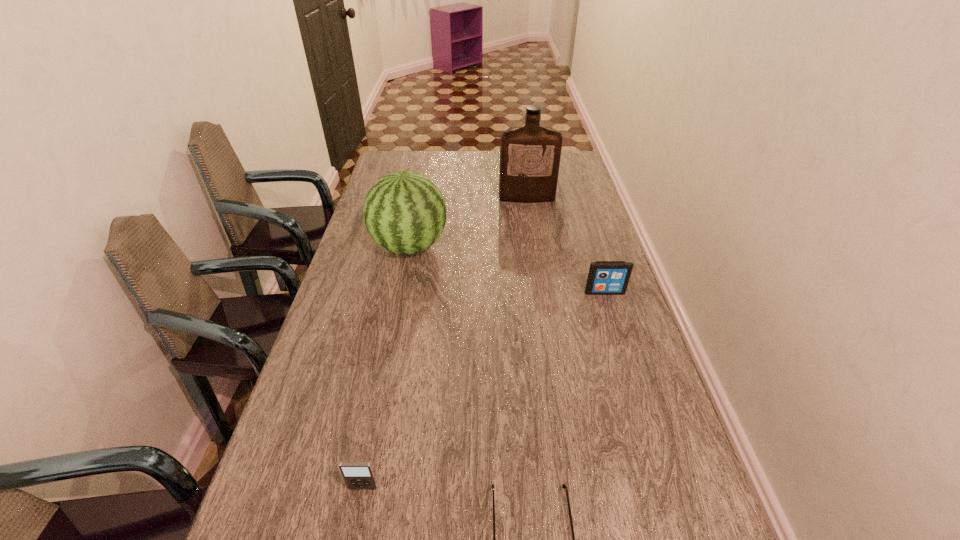
The height and width of the screenshot is (540, 960). In order to click on free space that is in between the second shortest object and the liquor in this screenshot , I will do `click(445, 343)`.

The height and width of the screenshot is (540, 960). Identify the location of vacant space that's between the third nearest object and the liquor. (565, 245).

Locate an element on the screen. This screenshot has height=540, width=960. unoccupied area between the farther iPod and the second tallest object is located at coordinates (507, 269).

Where is `free point between the shorter iPod and the watermelon`? free point between the shorter iPod and the watermelon is located at coordinates (386, 367).

Identify the location of free area in between the liquor and the third farthest object. (565, 245).

The height and width of the screenshot is (540, 960). What are the coordinates of `object that is the closest one to the rightmost object` in the screenshot? It's located at (404, 212).

Select which object is the closest to the tallest object. Please provide its 2D coordinates. Your answer should be formatted as a tuple, i.e. [(x, y)], where the tuple contains the x and y coordinates of a point satisfying the conditions above.

[(404, 212)]